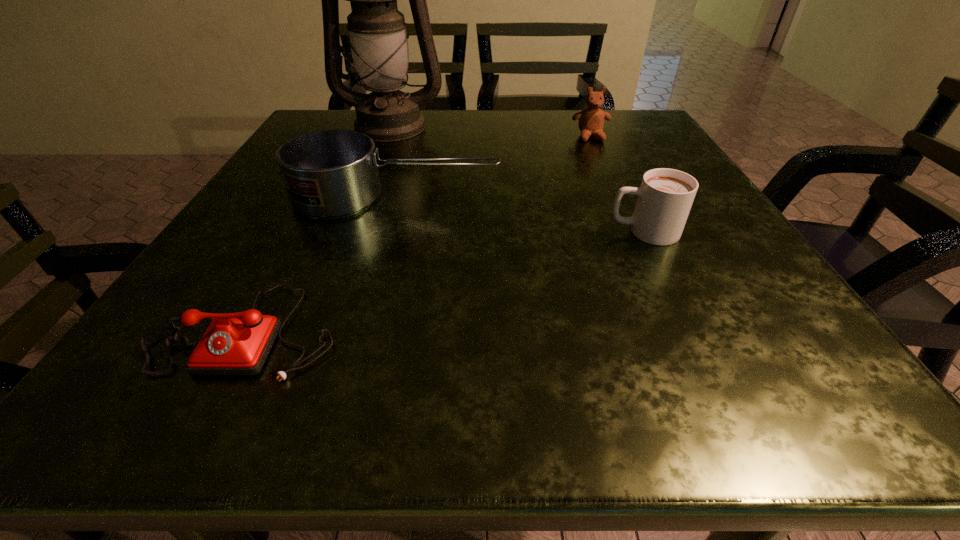
Image resolution: width=960 pixels, height=540 pixels. In order to click on object present at the far left corner in this screenshot , I will do `click(377, 30)`.

At what (x,y) coordinates should I click in order to perform the action: click on object that is at the near left corner. Please return your answer as a coordinate pair (x, y). Image resolution: width=960 pixels, height=540 pixels. Looking at the image, I should click on (238, 343).

What are the coordinates of `object that is at the far right corner` in the screenshot? It's located at (591, 120).

You are a GUI agent. You are given a task and a screenshot of the screen. Output one action in this format:
    pyautogui.click(x=<x>, y=<y>)
    Task: Click on the vacant position at the far edge of the desktop
    The height and width of the screenshot is (540, 960).
    Given the screenshot: What is the action you would take?
    pyautogui.click(x=435, y=136)

In the image, there is a desktop. At what (x,y) coordinates should I click in order to perform the action: click on vacant space at the left edge. Please return your answer as a coordinate pair (x, y). Looking at the image, I should click on (240, 297).

Image resolution: width=960 pixels, height=540 pixels. In order to click on free spot at the far left corner of the desktop in this screenshot , I will do `click(354, 115)`.

You are a GUI agent. You are given a task and a screenshot of the screen. Output one action in this format:
    pyautogui.click(x=<x>, y=<y>)
    Task: Click on the free location at the far right corner
    
    Given the screenshot: What is the action you would take?
    pyautogui.click(x=618, y=148)

I want to click on vacant point located between the telephone and the teddy bear, so click(x=419, y=234).

Locate an element on the screen. Image resolution: width=960 pixels, height=540 pixels. free space that is in between the oil lamp and the teddy bear is located at coordinates (491, 131).

The width and height of the screenshot is (960, 540). I want to click on free point between the oil lamp and the telephone, so click(x=319, y=228).